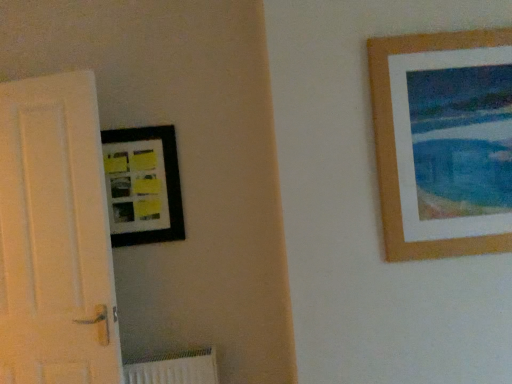
Question: Is white matte door at left aimed at wooden picture frame at upper right, which is counted as the first picture frame, starting from the front?

Choices:
 (A) yes
 (B) no

Answer: (B)

Question: From a real-world perspective, is white matte door at left on wooden picture frame at upper right, the 1th picture frame from the right?

Choices:
 (A) yes
 (B) no

Answer: (B)

Question: Is white matte door at left far from wooden picture frame at upper right, arranged as the 2th picture frame when viewed from the left?

Choices:
 (A) no
 (B) yes

Answer: (B)

Question: Is white matte door at left not within wooden picture frame at upper right, which is counted as the first picture frame, starting from the front?

Choices:
 (A) yes
 (B) no

Answer: (A)

Question: Is white matte door at left looking in the opposite direction of wooden picture frame at upper right, which is counted as the first picture frame, starting from the front?

Choices:
 (A) yes
 (B) no

Answer: (B)

Question: Can you confirm if white matte door at left is smaller than wooden picture frame at upper right, which is counted as the first picture frame, starting from the front?

Choices:
 (A) no
 (B) yes

Answer: (A)

Question: Is white matte door at left turned away from matte black picture frame at upper left, marked as the 2th picture frame in a right-to-left arrangement?

Choices:
 (A) yes
 (B) no

Answer: (A)

Question: Is white matte door at left behind matte black picture frame at upper left, marked as the 2th picture frame in a right-to-left arrangement?

Choices:
 (A) yes
 (B) no

Answer: (B)

Question: Does white matte door at left have a greater width compared to matte black picture frame at upper left, which is counted as the first picture frame, starting from the left?

Choices:
 (A) no
 (B) yes

Answer: (B)

Question: Is white matte door at left completely or partially outside of matte black picture frame at upper left, which is counted as the first picture frame, starting from the left?

Choices:
 (A) yes
 (B) no

Answer: (A)

Question: Can you confirm if white matte door at left is thinner than matte black picture frame at upper left, which is counted as the first picture frame, starting from the left?

Choices:
 (A) yes
 (B) no

Answer: (B)

Question: Can you confirm if white matte door at left is taller than matte black picture frame at upper left, arranged as the second picture frame when viewed from the front?

Choices:
 (A) no
 (B) yes

Answer: (B)

Question: Can we say matte black picture frame at upper left, the 1th picture frame positioned from the back, lies outside white matte door at left?

Choices:
 (A) no
 (B) yes

Answer: (B)